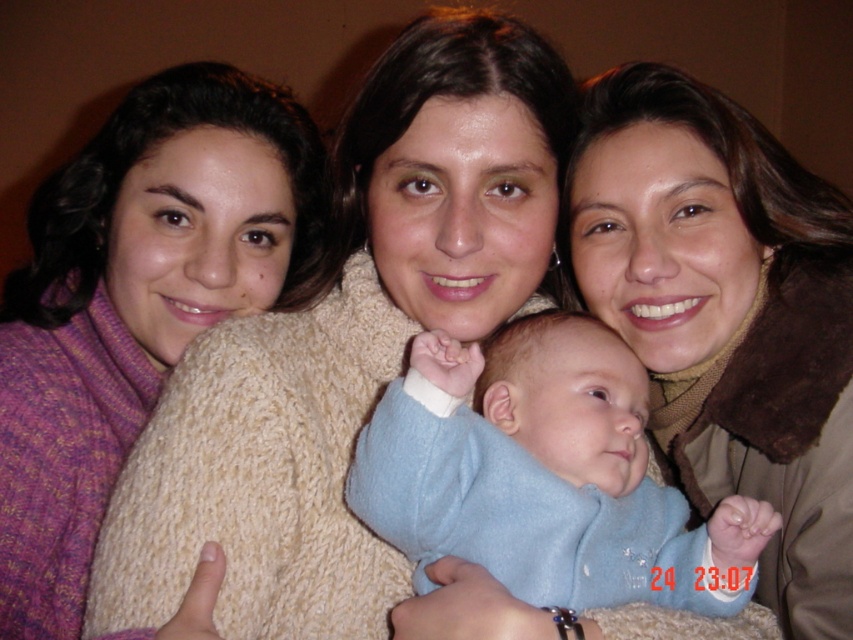
You are taking a family photo and need to arrange the two people wearing the purple knitted sweater at left and the light blue fleece at center. According to the scene, which clothing item should be placed to the left of the other?

The purple knitted sweater at left should be placed to the left of the light blue fleece at center because the purple knitted sweater at left is positioned on the left side of light blue fleece at center.

Consider the image. You are a photographer trying to capture the baby in the light blue fleece at center. Since the beige knitted sweater at center is blocking the view, can you move around to see the baby?

The light blue fleece at center is behind the beige knitted sweater at center, so moving around the beige knitted sweater at center may allow you to see the baby.